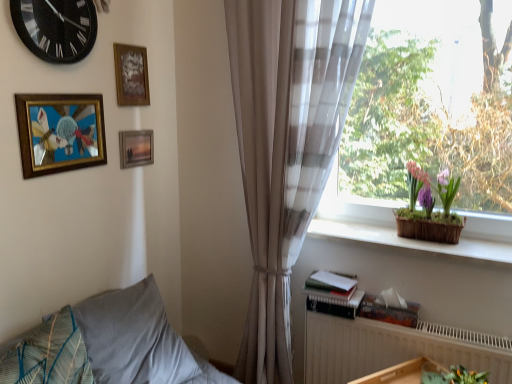
I want to click on vacant area located to the right-hand side of matte brown pot at window, so click(x=486, y=248).